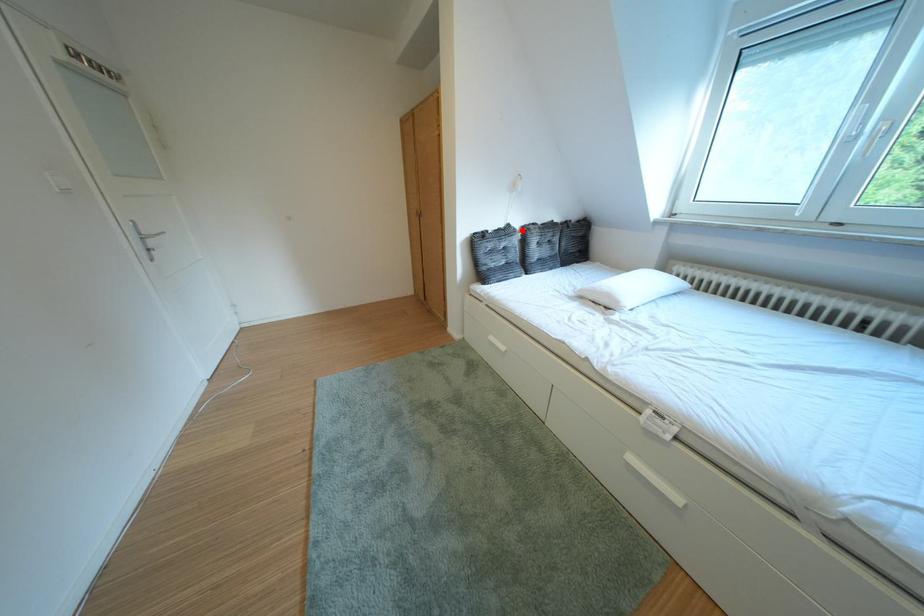
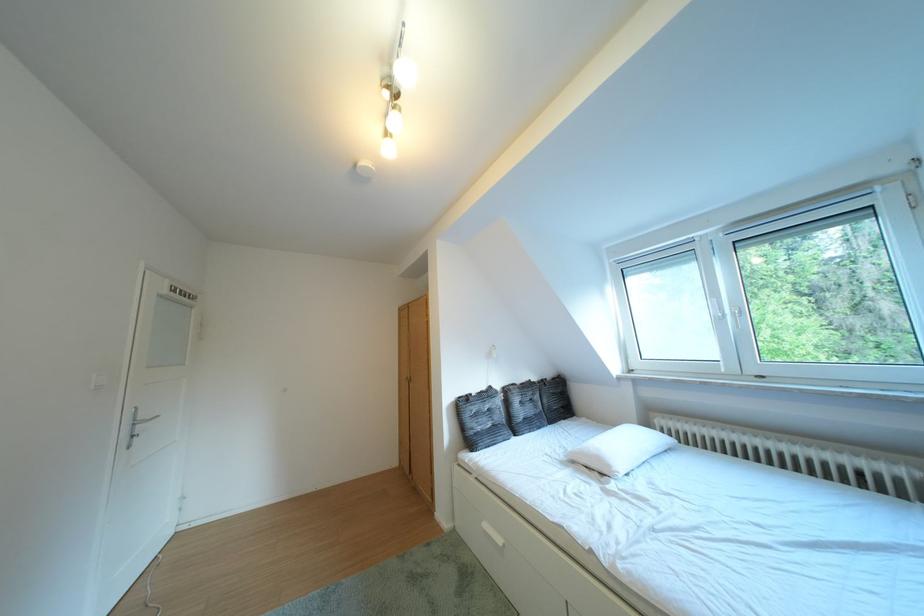
In the second image, find the point that corresponds to the highlighted location in the first image.

(504, 392)